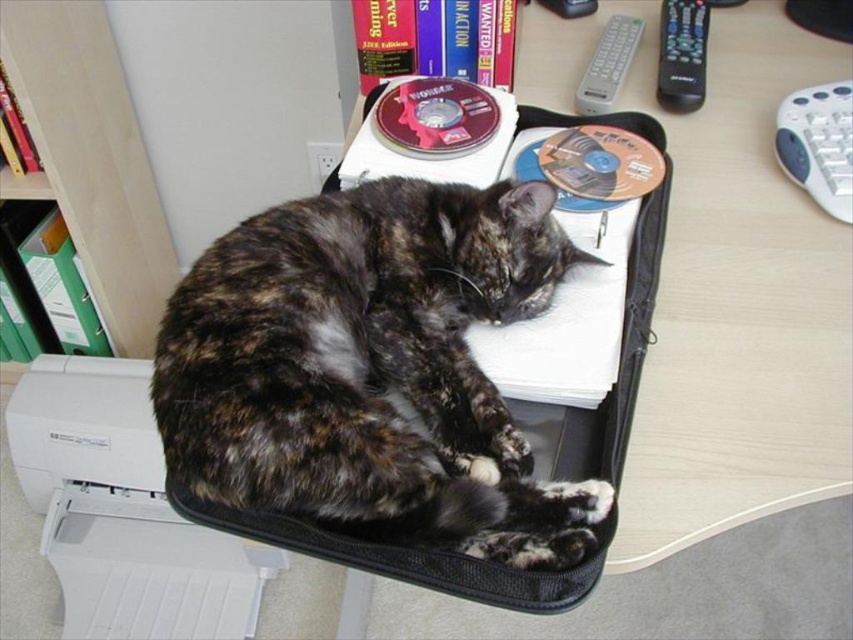
You need to place a new folder on the desk next to the tortoiseshell fur cat at center and the green plastic file at upper left. Based on their positions, which object is closer to the left edge of the desk?

The green plastic file at upper left is closer to the left edge of the desk because the tortoiseshell fur cat at center is to the right of it.

You are organizing items in the open black suitcase on the desk. You need to place a new folder in the suitcase without disturbing the tortoiseshell fur cat at center. Where should you place the folder to avoid the cat?

The tortoiseshell fur cat at center is located at point (370, 368). To avoid disturbing the cat, place the new folder in an area of the suitcase that does not overlap with the cat, such as near the edges or corners away from the cat.

You are organizing your desk and need to access the green plastic file at upper left. There is a tortoiseshell fur cat at center in the way. Can you reach the file without moving the cat?

The tortoiseshell fur cat at center is positioned under the green plastic file at upper left, so you can reach the file without moving the cat since it is located above the cat.